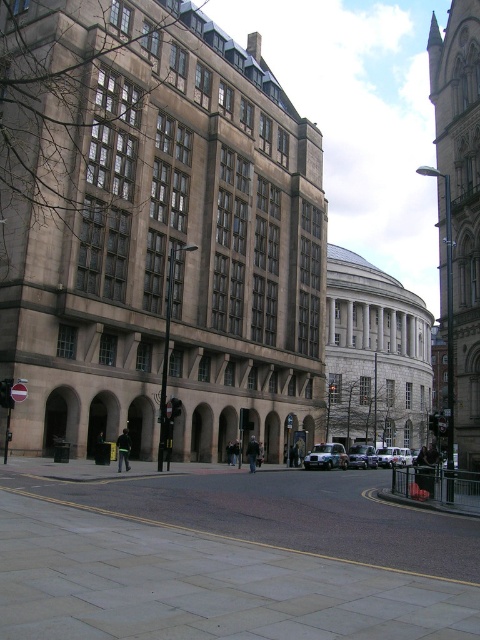
You are a delivery driver who needs to park your white matte van at center in a parking spot that is 20 feet away from the nearest vehicle. Is the metallic silver car at center too close to your van?

The distance between the metallic silver car at center and the white matte van at center is 36.31 feet, which is more than the required 20 feet. Therefore, the metallic silver car at center is not too close to the white matte van at center.

You are a delivery person trying to park your silver metallic car at center in the narrow alley between the two buildings. There is another metallic silver car at center already parked. Which car should you move to allow space for your vehicle?

The metallic silver car at center is on the left side of the silver metallic car at center. Since both cars are metallic silver and positioned centrally, you should move the metallic silver car at center to the left to create space for the silver metallic car at center.